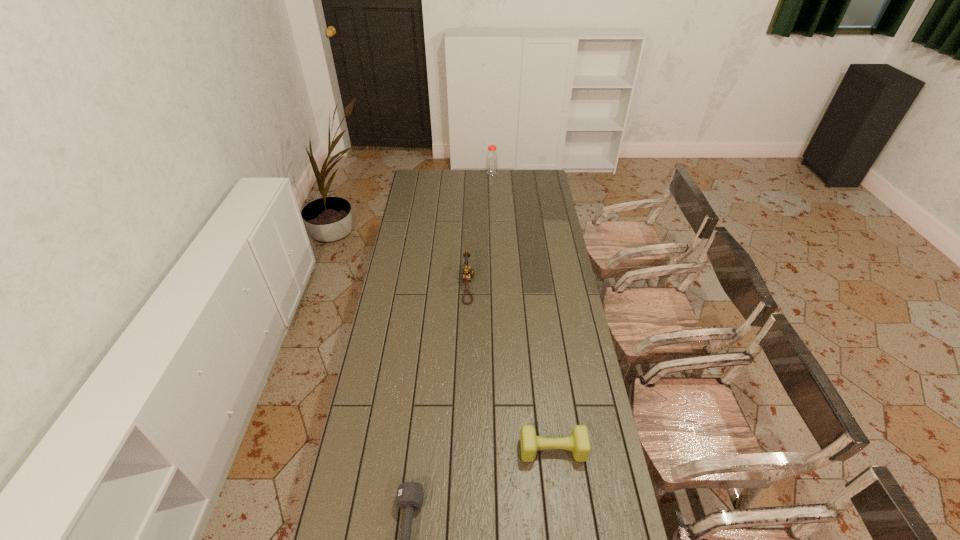
What are the coordinates of `object located at the right edge` in the screenshot? It's located at (579, 443).

In the image, there is a desktop. Identify the location of vacant area at the far edge. The height and width of the screenshot is (540, 960). [x=507, y=186].

The image size is (960, 540). Find the location of `vacant region at the left edge of the desktop`. vacant region at the left edge of the desktop is located at coordinates (408, 355).

The width and height of the screenshot is (960, 540). What are the coordinates of `vacant region at the right edge of the desktop` in the screenshot? It's located at (540, 246).

Locate an element on the screen. This screenshot has height=540, width=960. free region at the far left corner is located at coordinates (425, 177).

Where is `vacant space in between the right dumbbell and the farthest object`? vacant space in between the right dumbbell and the farthest object is located at coordinates (522, 312).

In order to click on vacant area that lies between the tallest object and the telephone in this screenshot , I will do `click(480, 229)`.

You are a GUI agent. You are given a task and a screenshot of the screen. Output one action in this format:
    pyautogui.click(x=<x>, y=<y>)
    Task: Click on the closest object to the left dumbbell
    
    Given the screenshot: What is the action you would take?
    pyautogui.click(x=579, y=443)

The image size is (960, 540). I want to click on object that is the third closest to the third shortest object, so click(x=491, y=158).

The width and height of the screenshot is (960, 540). I want to click on free space in the image that satisfies the following two spatial constraints: 1. on the back side of the third tallest object; 2. on the front-facing side of the third shortest object, so click(532, 285).